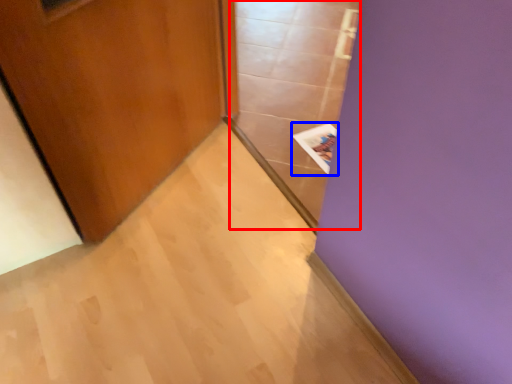
Question: Among these objects, which one is farthest to the camera, glass door (highlighted by a red box) or magazine (highlighted by a blue box)?

Choices:
 (A) glass door
 (B) magazine

Answer: (B)